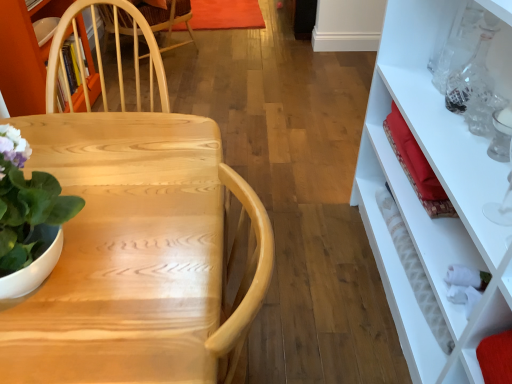
I want to click on transparent glass bottle at upper right, the 1th bottle positioned from the top, so click(472, 70).

What do you see at coordinates (28, 218) in the screenshot? I see `green matte plant at left` at bounding box center [28, 218].

Identify the location of white textured bottle at right, which appears as the first bottle when ordered from the bottom. This screenshot has height=384, width=512. click(x=414, y=269).

In order to face natural wood desk at center, should I rotate leftwards or rightwards?

Turn left approximately 11.251 degrees to face it.

Identify the location of transparent glass bottle at upper right, the 2th bottle in the left-to-right sequence. The height and width of the screenshot is (384, 512). (472, 70).

Is transparent glass bottle at upper right, the 2th bottle in the left-to-right sequence, bigger than natural wood desk at center?

No.

Looking at this image, which object is thinner, transparent glass bottle at upper right, which is the first bottle in right-to-left order, or natural wood desk at center?

transparent glass bottle at upper right, which is the first bottle in right-to-left order.

Which point is more distant from viewer, (487,35) or (201,184)?

The point (487,35) is behind.

From the image's perspective, is transparent glass bottle at upper right, the 2th bottle in the left-to-right sequence, above natural wood desk at center?

Yes, from the image's perspective, transparent glass bottle at upper right, the 2th bottle in the left-to-right sequence, is above natural wood desk at center.

Does white textured bottle at right, the 1th bottle in the left-to-right sequence, have a smaller size compared to green matte plant at left?

Correct, white textured bottle at right, the 1th bottle in the left-to-right sequence, occupies less space than green matte plant at left.

Is white textured bottle at right, which appears as the first bottle when ordered from the bottom, wider than green matte plant at left?

Incorrect, the width of white textured bottle at right, which appears as the first bottle when ordered from the bottom, does not surpass that of green matte plant at left.

From a real-world perspective, which is physically below, white textured bottle at right, arranged as the 2th bottle when viewed from the right, or green matte plant at left?

From a 3D spatial view, white textured bottle at right, arranged as the 2th bottle when viewed from the right, is below.

Consider the image. Is white textured bottle at right, which appears as the first bottle when ordered from the bottom, turned away from green matte plant at left?

white textured bottle at right, which appears as the first bottle when ordered from the bottom, is not turned away from green matte plant at left.

From the image's perspective, between green matte plant at left and white textured bottle at right, the second bottle positioned from the top, who is located below?

white textured bottle at right, the second bottle positioned from the top, from the image's perspective.

Identify the location of bottle located below the green matte plant at left (from the image's perspective). (414, 269).

Is green matte plant at left completely or partially outside of white textured bottle at right, the 1th bottle in the left-to-right sequence?

green matte plant at left lies outside white textured bottle at right, the 1th bottle in the left-to-right sequence,'s area.

From a real-world perspective, which object rests below the other?

white textured bottle at right, which appears as the first bottle when ordered from the bottom, from a real-world perspective.

Measure the distance between white textured bottle at right, arranged as the 2th bottle when viewed from the right, and natural wood desk at center.

white textured bottle at right, arranged as the 2th bottle when viewed from the right, is 29.69 inches away from natural wood desk at center.

Considering the positions of point (387, 211) and point (131, 343), is point (387, 211) closer or farther from the camera than point (131, 343)?

Clearly, point (387, 211) is more distant from the camera than point (131, 343).

Is white textured bottle at right, the second bottle positioned from the top, aimed at natural wood desk at center?

No.

Does white textured bottle at right, which appears as the first bottle when ordered from the bottom, touch natural wood desk at center?

white textured bottle at right, which appears as the first bottle when ordered from the bottom, is not next to natural wood desk at center, and they're not touching.

Is white textured bottle at right, the second bottle positioned from the top, placed right next to transparent glass bottle at upper right, which is the first bottle in right-to-left order?

No, white textured bottle at right, the second bottle positioned from the top, is not with transparent glass bottle at upper right, which is the first bottle in right-to-left order.

Is point (416, 278) behind point (470, 69)?

That is False.

Considering the sizes of objects white textured bottle at right, arranged as the 2th bottle when viewed from the right, and transparent glass bottle at upper right, which is the first bottle in right-to-left order, in the image provided, who is bigger, white textured bottle at right, arranged as the 2th bottle when viewed from the right, or transparent glass bottle at upper right, which is the first bottle in right-to-left order,?

white textured bottle at right, arranged as the 2th bottle when viewed from the right, is bigger.

From the picture: Does white textured bottle at right, the second bottle positioned from the top, appear on the right side of transparent glass bottle at upper right, which ranks as the 2th bottle in bottom-to-top order?

In fact, white textured bottle at right, the second bottle positioned from the top, is to the left of transparent glass bottle at upper right, which ranks as the 2th bottle in bottom-to-top order.

Find the location of a particular element. Image resolution: width=512 pixels, height=384 pixels. desk below the green matte plant at left (from the image's perspective) is located at coordinates (135, 254).

Considering the positions of objects natural wood desk at center and green matte plant at left in the image provided, who is more to the right, natural wood desk at center or green matte plant at left?

natural wood desk at center.

Is natural wood desk at center situated inside green matte plant at left or outside?

natural wood desk at center is located beyond the bounds of green matte plant at left.

Which object is closer to the camera, natural wood desk at center or green matte plant at left?

green matte plant at left is more forward.

Who is taller, green matte plant at left or transparent glass bottle at upper right, which ranks as the 2th bottle in bottom-to-top order?

With more height is green matte plant at left.

Is green matte plant at left oriented towards transparent glass bottle at upper right, the 1th bottle positioned from the top?

No, green matte plant at left is not turned towards transparent glass bottle at upper right, the 1th bottle positioned from the top.

Based on the photo, can you confirm if green matte plant at left is positioned to the left of transparent glass bottle at upper right, which ranks as the 2th bottle in bottom-to-top order?

Yes.

Does green matte plant at left have a larger size compared to transparent glass bottle at upper right, which ranks as the 2th bottle in bottom-to-top order?

Yes, green matte plant at left is bigger than transparent glass bottle at upper right, which ranks as the 2th bottle in bottom-to-top order.

From the image's perspective, starting from the natural wood desk at center, which bottle is the 2nd one above? Please provide its 2D coordinates.

[(472, 70)]

Locate an element on the screen. the 2nd bottle below the green matte plant at left (from a real-world perspective) is located at coordinates (414, 269).

Looking at the image, which one is located closer to white textured bottle at right, which appears as the first bottle when ordered from the bottom, natural wood desk at center or transparent glass bottle at upper right, the 1th bottle positioned from the top?

transparent glass bottle at upper right, the 1th bottle positioned from the top, lies closer to white textured bottle at right, which appears as the first bottle when ordered from the bottom, than the other object.

Based on their spatial positions, is white textured bottle at right, arranged as the 2th bottle when viewed from the right, or green matte plant at left closer to transparent glass bottle at upper right, the 2th bottle in the left-to-right sequence?

The object closer to transparent glass bottle at upper right, the 2th bottle in the left-to-right sequence, is white textured bottle at right, arranged as the 2th bottle when viewed from the right.

Looking at the image, which one is located further to white textured bottle at right, arranged as the 2th bottle when viewed from the right, natural wood desk at center or green matte plant at left?

Based on the image, green matte plant at left appears to be further to white textured bottle at right, arranged as the 2th bottle when viewed from the right.

Estimate the real-world distances between objects in this image. Which object is further from white textured bottle at right, the second bottle positioned from the top, transparent glass bottle at upper right, the 1th bottle positioned from the top, or natural wood desk at center?

natural wood desk at center lies further to white textured bottle at right, the second bottle positioned from the top, than the other object.

Estimate the real-world distances between objects in this image. Which object is further from transparent glass bottle at upper right, the 1th bottle positioned from the top, natural wood desk at center or green matte plant at left?

green matte plant at left is positioned further to the anchor transparent glass bottle at upper right, the 1th bottle positioned from the top.

Looking at the image, which one is located further to green matte plant at left, natural wood desk at center or transparent glass bottle at upper right, the 2th bottle in the left-to-right sequence?

transparent glass bottle at upper right, the 2th bottle in the left-to-right sequence.

Estimate the real-world distances between objects in this image. Which object is closer to natural wood desk at center, transparent glass bottle at upper right, which ranks as the 2th bottle in bottom-to-top order, or white textured bottle at right, the 1th bottle in the left-to-right sequence?

white textured bottle at right, the 1th bottle in the left-to-right sequence, lies closer to natural wood desk at center than the other object.

Which object lies further to the anchor point transparent glass bottle at upper right, which is the first bottle in right-to-left order, natural wood desk at center or white textured bottle at right, which appears as the first bottle when ordered from the bottom?

natural wood desk at center is positioned further to the anchor transparent glass bottle at upper right, which is the first bottle in right-to-left order.

Identify the location of desk between green matte plant at left and white textured bottle at right, arranged as the 2th bottle when viewed from the right, from left to right. The image size is (512, 384). (135, 254).

The width and height of the screenshot is (512, 384). Find the location of `bottle between green matte plant at left and transparent glass bottle at upper right, the 2th bottle in the left-to-right sequence, in the horizontal direction`. bottle between green matte plant at left and transparent glass bottle at upper right, the 2th bottle in the left-to-right sequence, in the horizontal direction is located at coordinates (414, 269).

You are a GUI agent. You are given a task and a screenshot of the screen. Output one action in this format:
    pyautogui.click(x=<x>, y=<y>)
    Task: Click on the desk between green matte plant at left and transparent glass bottle at upper right, the 1th bottle positioned from the top, in the horizontal direction
    
    Given the screenshot: What is the action you would take?
    pyautogui.click(x=135, y=254)

Locate an element on the screen. The width and height of the screenshot is (512, 384). bottle between natural wood desk at center and transparent glass bottle at upper right, which ranks as the 2th bottle in bottom-to-top order, in the horizontal direction is located at coordinates (414, 269).